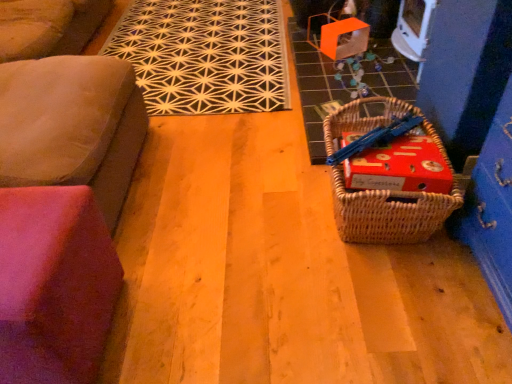
Find the location of a particular element. This screenshot has width=512, height=384. free space in front of woven brown picnic basket at lower right is located at coordinates (399, 302).